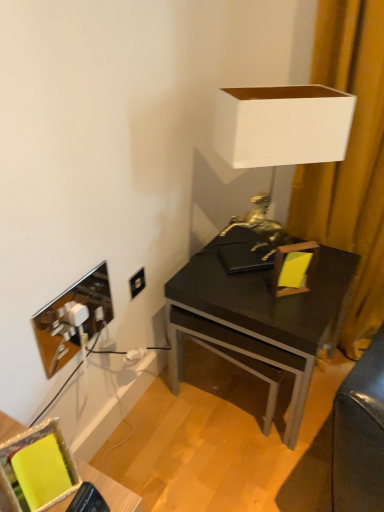
Locate an element on the screen. This screenshot has height=512, width=384. free point above matte black desk at center (from a real-world perspective) is located at coordinates (257, 276).